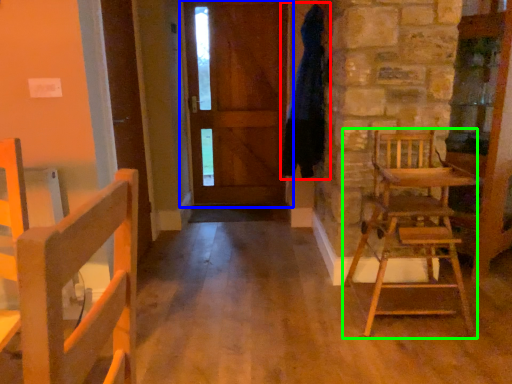
Question: Considering the real-world distances, which object is closest to bathrobe (highlighted by a red box)? door (highlighted by a blue box) or chair (highlighted by a green box).

Choices:
 (A) door
 (B) chair

Answer: (B)